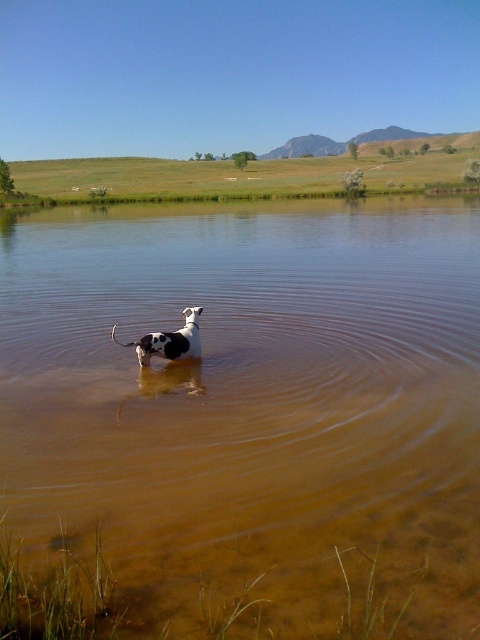
You are a photographer trying to capture the black and white spotted dog at center in the image. To ensure the background is clear, you want to position yourself so that the brown translucent water at center is to the right of the dog. Is this possible based on the scene?

Yes, since the brown translucent water at center is already positioned to the right of the black and white spotted dog at center, the photographer can frame the shot accordingly to have the water on the dog.

You are a hiker who wants to cross the lake to reach the other side. You have a small boat that can carry you and your gear, but it requires at least 20 feet of distance to safely launch. Based on the scene, is the distance between the brown translucent water at center and the black and white spotted dog at center sufficient for launching your boat?

The brown translucent water at center is 22.49 feet away from the black and white spotted dog at center. Since the required distance is 20 feet, the available space is sufficient for launching the boat safely.

Consider the image. You are a photographer trying to capture the black and white spotted dog at center in the frame. The brown translucent water at center is obstructing the view. Can you estimate whether the water is wider or narrower than the dog?

The brown translucent water at center is wider than the black and white spotted dog at center, so the water is wider than the dog.